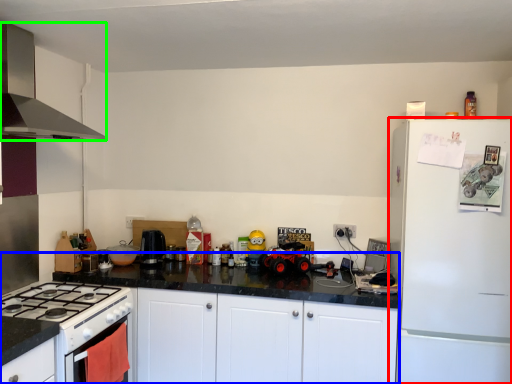
Question: Based on their relative distances, which object is farther from refrigerator (highlighted by a red box)? Choose from counter (highlighted by a blue box) and kitchen appliance (highlighted by a green box).

Choices:
 (A) counter
 (B) kitchen appliance

Answer: (B)